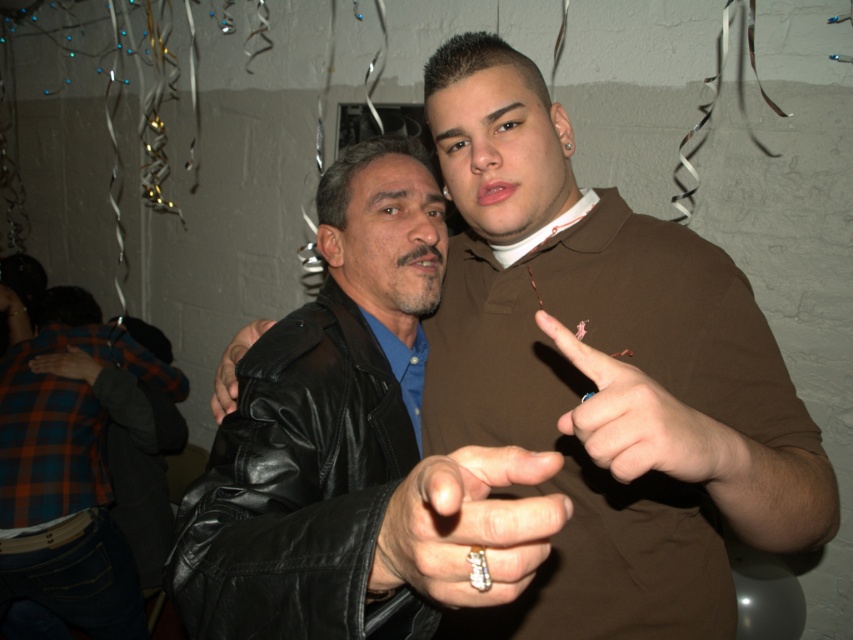
Question: Which point is closer to the camera taking this photo?

Choices:
 (A) (344, 627)
 (B) (73, 346)
 (C) (15, 429)
 (D) (645, 468)

Answer: (A)

Question: Estimate the real-world distances between objects in this image. Which object is farther from the black leather jacket at left?

Choices:
 (A) brown leather jacket at center
 (B) plaid fabric hand at lower left
 (C) black leather jacket at center

Answer: (B)

Question: Is gold metallic ring at center to the left of black leather jacket at left from the viewer's perspective?

Choices:
 (A) no
 (B) yes

Answer: (A)

Question: Based on their relative distances, which object is farther from the plaid fabric hand at lower left?

Choices:
 (A) leather jacket at left
 (B) smooth brown leather hand at center
 (C) black leather jacket at left
 (D) gold metallic ring at center

Answer: (D)

Question: Does leather jacket at left have a larger size compared to smooth brown leather hand at center?

Choices:
 (A) yes
 (B) no

Answer: (A)

Question: Can you confirm if gold metallic ring at center is positioned to the left of smooth brown leather hand at center?

Choices:
 (A) no
 (B) yes

Answer: (B)